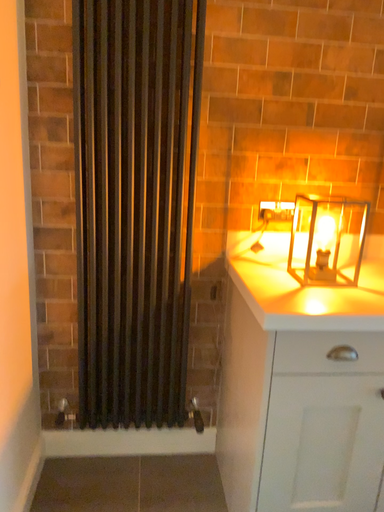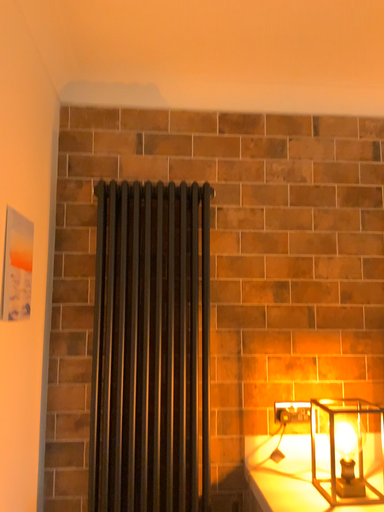
Question: How did the camera likely rotate when shooting the video?

Choices:
 (A) rotated downward
 (B) rotated upward

Answer: (B)